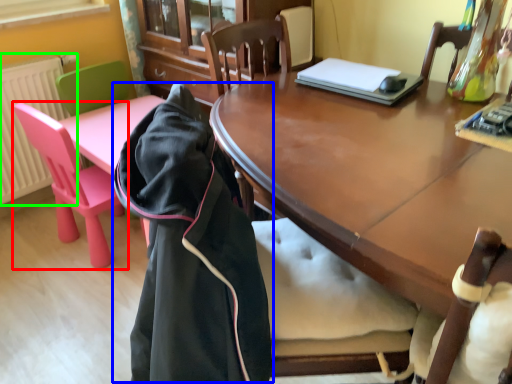
Question: Based on their relative distances, which object is nearer to chair (highlighted by a red box)? Choose from cloak (highlighted by a blue box) and radiator (highlighted by a green box).

Choices:
 (A) cloak
 (B) radiator

Answer: (B)